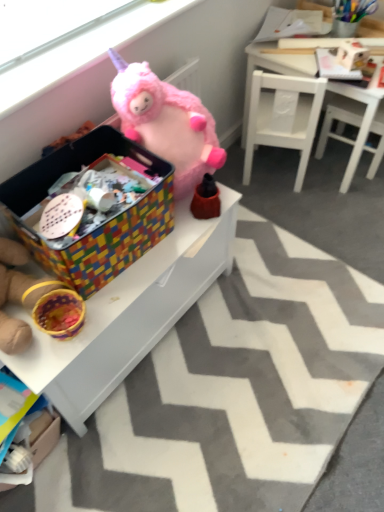
I want to click on spots to the right of multicolored woven basket at left, which is the third toy in top-to-bottom order, so (115, 303).